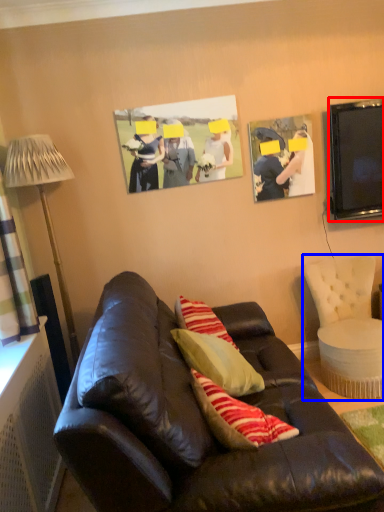
Question: Among these objects, which one is farthest to the camera, television (highlighted by a red box) or chair (highlighted by a blue box)?

Choices:
 (A) television
 (B) chair

Answer: (A)